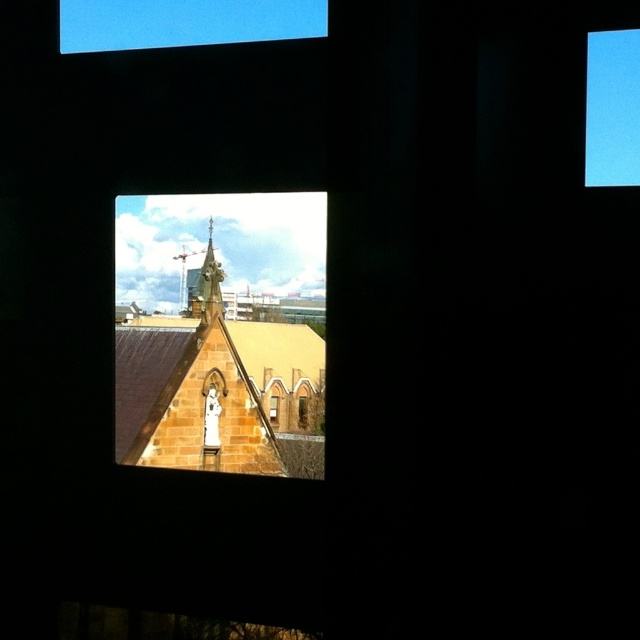
You are an architect evaluating the structural integrity of the brown stone church at center and the transparent glass window at lower center. Based on their heights, which one might require additional support due to its greater height?

The brown stone church at center has a greater height compared to the transparent glass window at lower center, so it might require additional support due to its greater height.